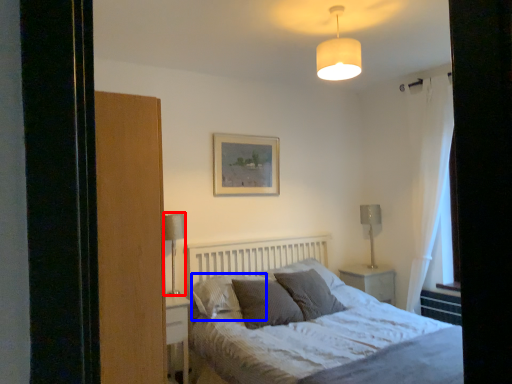
Question: Which object appears closest to the camera in this image, table lamp (highlighted by a red box) or pillow (highlighted by a blue box)?

Choices:
 (A) table lamp
 (B) pillow

Answer: (B)